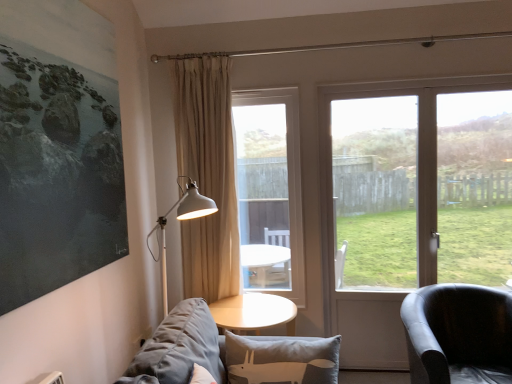
Question: Considering the relative positions of black leather armchair at right and transparent glass screen door at right in the image provided, is black leather armchair at right to the left of transparent glass screen door at right from the viewer's perspective?

Choices:
 (A) no
 (B) yes

Answer: (A)

Question: From a real-world perspective, is black leather armchair at right physically below transparent glass screen door at right?

Choices:
 (A) yes
 (B) no

Answer: (A)

Question: Is black leather armchair at right aimed at transparent glass screen door at right?

Choices:
 (A) no
 (B) yes

Answer: (A)

Question: Can you confirm if black leather armchair at right is smaller than transparent glass screen door at right?

Choices:
 (A) yes
 (B) no

Answer: (B)

Question: Is black leather armchair at right beside transparent glass screen door at right?

Choices:
 (A) no
 (B) yes

Answer: (A)

Question: Considering the relative sizes of black leather armchair at right and transparent glass screen door at right in the image provided, is black leather armchair at right taller than transparent glass screen door at right?

Choices:
 (A) yes
 (B) no

Answer: (B)

Question: Considering the relative sizes of gray fabric couch at lower left and beige fabric curtain at center in the image provided, is gray fabric couch at lower left shorter than beige fabric curtain at center?

Choices:
 (A) yes
 (B) no

Answer: (A)

Question: Could you tell me if gray fabric couch at lower left is turned towards beige fabric curtain at center?

Choices:
 (A) no
 (B) yes

Answer: (A)

Question: Are gray fabric couch at lower left and beige fabric curtain at center located far from each other?

Choices:
 (A) yes
 (B) no

Answer: (A)

Question: Can beige fabric curtain at center be found inside gray fabric couch at lower left?

Choices:
 (A) yes
 (B) no

Answer: (B)

Question: From the image's perspective, does gray fabric couch at lower left appear higher than beige fabric curtain at center?

Choices:
 (A) no
 (B) yes

Answer: (A)

Question: Is the position of gray fabric couch at lower left more distant than that of beige fabric curtain at center?

Choices:
 (A) no
 (B) yes

Answer: (A)

Question: Can you confirm if transparent glass screen door at right is bigger than clear glass window at center, which appears as the 2th window when viewed from the right?

Choices:
 (A) no
 (B) yes

Answer: (A)